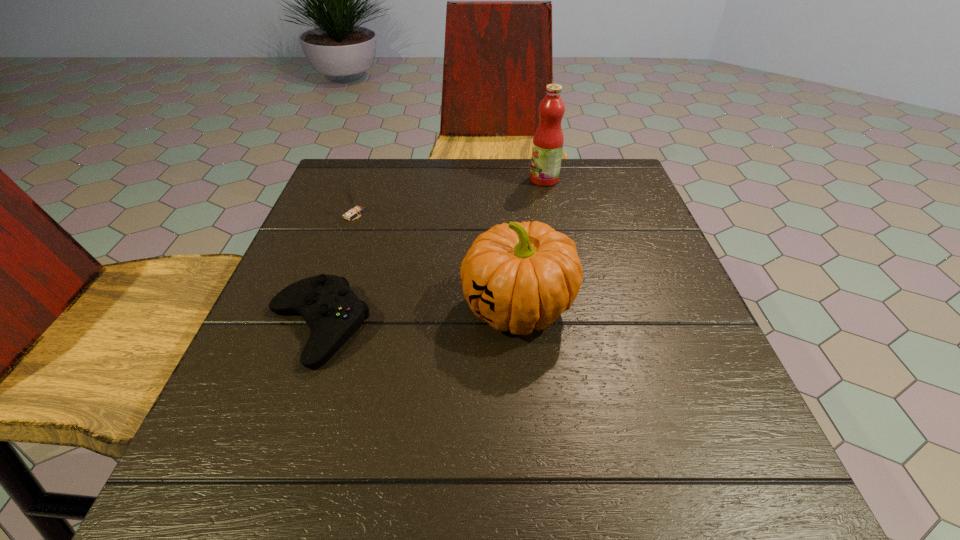
Image resolution: width=960 pixels, height=540 pixels. Find the location of `vacant region at the near edge of the desktop`. vacant region at the near edge of the desktop is located at coordinates (386, 461).

Image resolution: width=960 pixels, height=540 pixels. Find the location of `free space at the left edge of the desktop`. free space at the left edge of the desktop is located at coordinates (345, 236).

In the image, there is a desktop. Identify the location of vacant region at the right edge. (688, 430).

Find the location of a particular element. blank area at the far left corner is located at coordinates (393, 164).

Identify the location of vacant space at the far right corner of the desktop. (610, 191).

Locate an element on the screen. free spot between the second shortest object and the fruit juice is located at coordinates (449, 197).

Locate an element on the screen. This screenshot has width=960, height=540. empty location between the matchbox and the fruit juice is located at coordinates (449, 197).

Where is `empty space between the control and the farthest object`? empty space between the control and the farthest object is located at coordinates (431, 253).

This screenshot has height=540, width=960. What are the coordinates of `free space between the pumpkin and the control` in the screenshot? It's located at (418, 318).

Where is `free space that is in between the third tallest object and the second tallest object`? The image size is (960, 540). free space that is in between the third tallest object and the second tallest object is located at coordinates (436, 261).